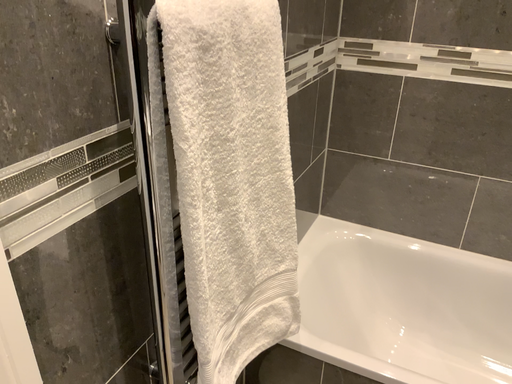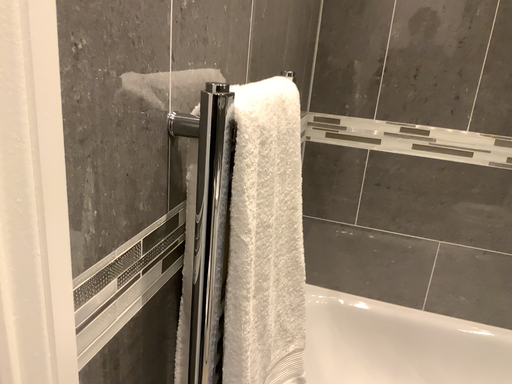
Question: How did the camera likely rotate when shooting the video?

Choices:
 (A) rotated right
 (B) rotated left

Answer: (A)